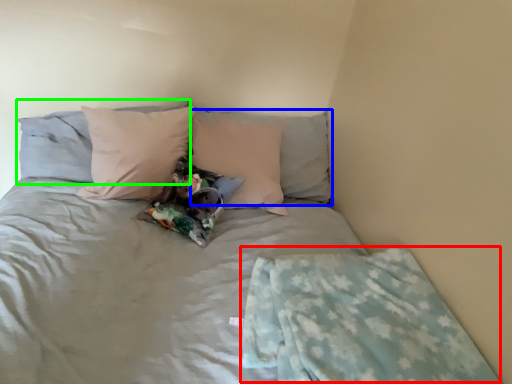
Question: Which object is the closest to the blanket (highlighted by a red box)? Choose among these: pillow (highlighted by a blue box) or pillow (highlighted by a green box).

Choices:
 (A) pillow
 (B) pillow

Answer: (A)